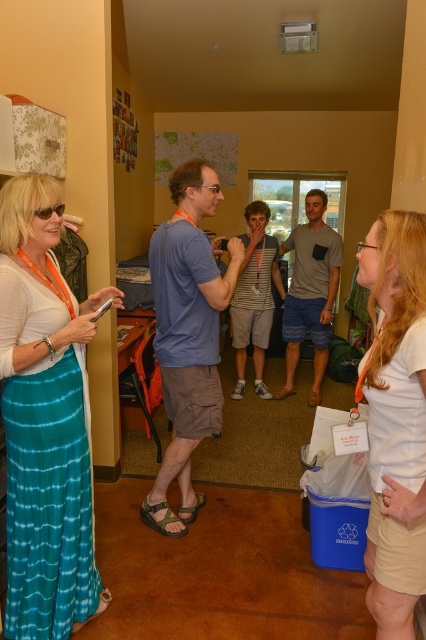
Who is lower down, teal tie-dye skirt at left or white cotton shirt at right?

teal tie-dye skirt at left is lower down.

Does point (8, 435) come closer to viewer compared to point (420, 560)?

No, (8, 435) is further to viewer.

I want to click on teal tie-dye skirt at left, so click(46, 420).

Does blue cotton t-shirt at center have a lesser width compared to gray cotton t-shirt at center?

Incorrect, blue cotton t-shirt at center's width is not less than gray cotton t-shirt at center's.

How far apart are blue cotton t-shirt at center and gray cotton t-shirt at center?

blue cotton t-shirt at center is 5.81 feet away from gray cotton t-shirt at center.

Is point (198, 308) farther from camera compared to point (310, 394)?

No, (198, 308) is closer to viewer.

This screenshot has height=640, width=426. Find the location of `blue cotton t-shirt at center`. blue cotton t-shirt at center is located at coordinates (187, 336).

Which is more to the right, teal tie-dye skirt at left or blue cotton t-shirt at center?

From the viewer's perspective, blue cotton t-shirt at center appears more on the right side.

Which is below, teal tie-dye skirt at left or blue cotton t-shirt at center?

teal tie-dye skirt at left is lower down.

The height and width of the screenshot is (640, 426). What are the coordinates of `teal tie-dye skirt at left` in the screenshot? It's located at (46, 420).